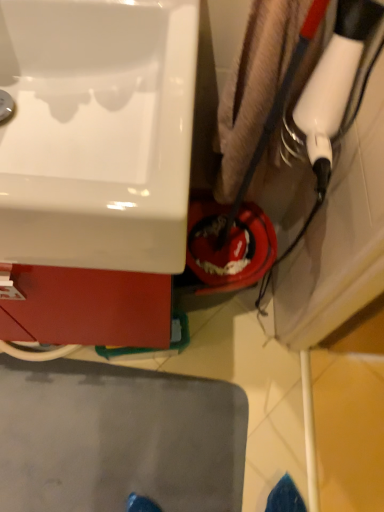
Question: Should I look upward or downward to see white glossy sink at upper left?

Choices:
 (A) up
 (B) down

Answer: (A)